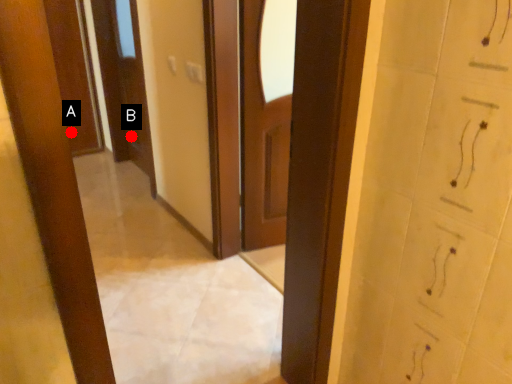
Question: Two points are circled on the image, labeled by A and B beside each circle. Which point is farther from the camera taking this photo?

Choices:
 (A) A is further
 (B) B is further

Answer: (A)